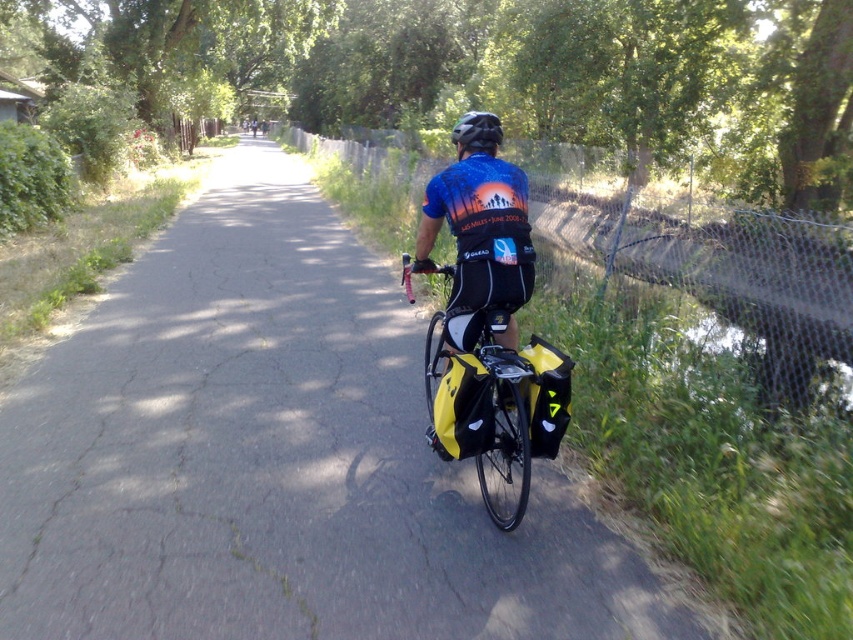
Question: Can you confirm if yellow matte bag at center is thinner than matte black helmet at center?

Choices:
 (A) no
 (B) yes

Answer: (B)

Question: Among these points, which one is farthest from the camera?

Choices:
 (A) (476, 358)
 (B) (572, 556)
 (C) (480, 138)

Answer: (C)

Question: Which point appears farthest from the camera in this image?

Choices:
 (A) (502, 401)
 (B) (451, 140)
 (C) (56, 412)

Answer: (B)

Question: Is yellow matte bag at center closer to camera compared to matte black helmet at center?

Choices:
 (A) yes
 (B) no

Answer: (A)

Question: Is the position of yellow fabric bag at center more distant than that of matte black helmet at center?

Choices:
 (A) no
 (B) yes

Answer: (A)

Question: Estimate the real-world distances between objects in this image. Which object is closer to the yellow matte bag at center?

Choices:
 (A) matte black helmet at center
 (B) yellow fabric bag at center

Answer: (B)